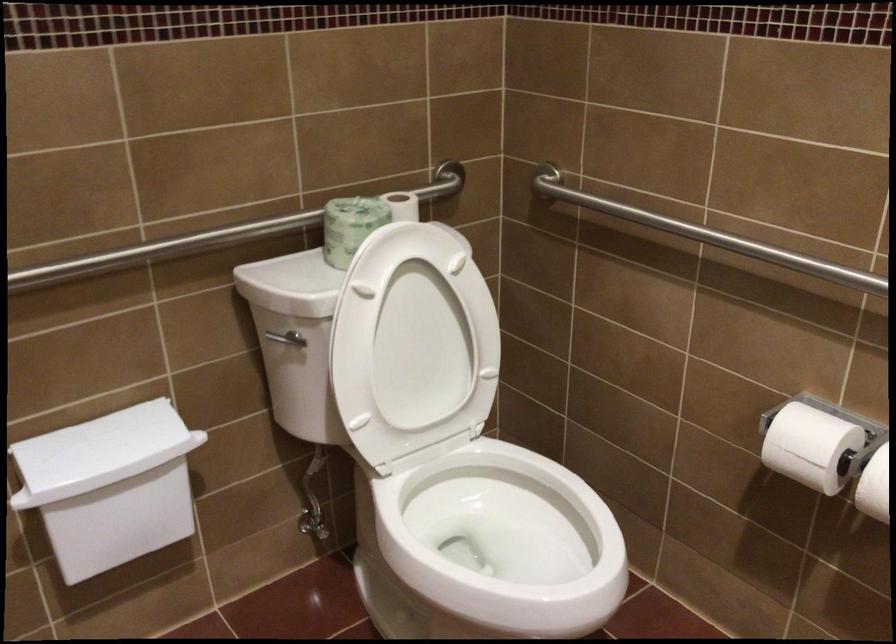
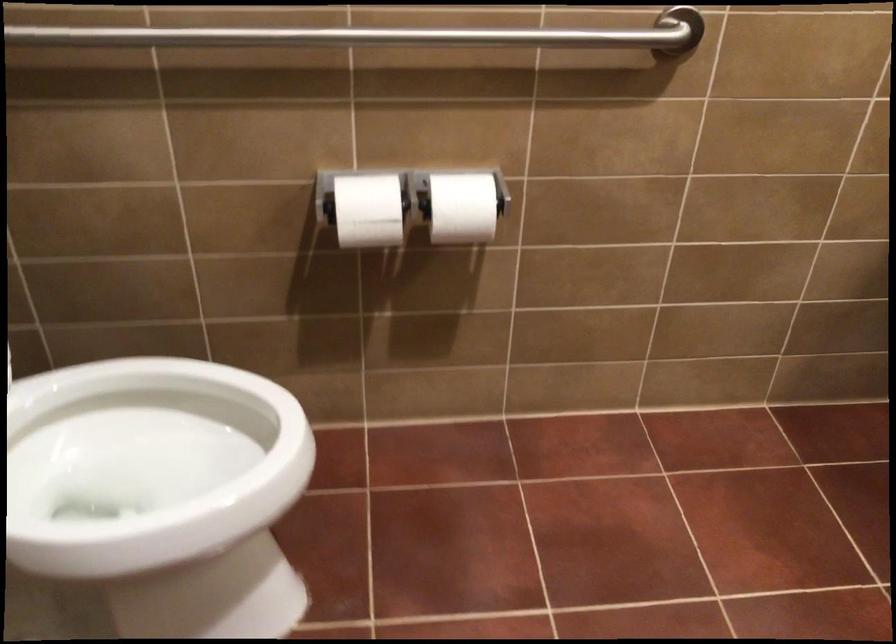
How did the camera likely rotate?

The camera rotated toward right-down.